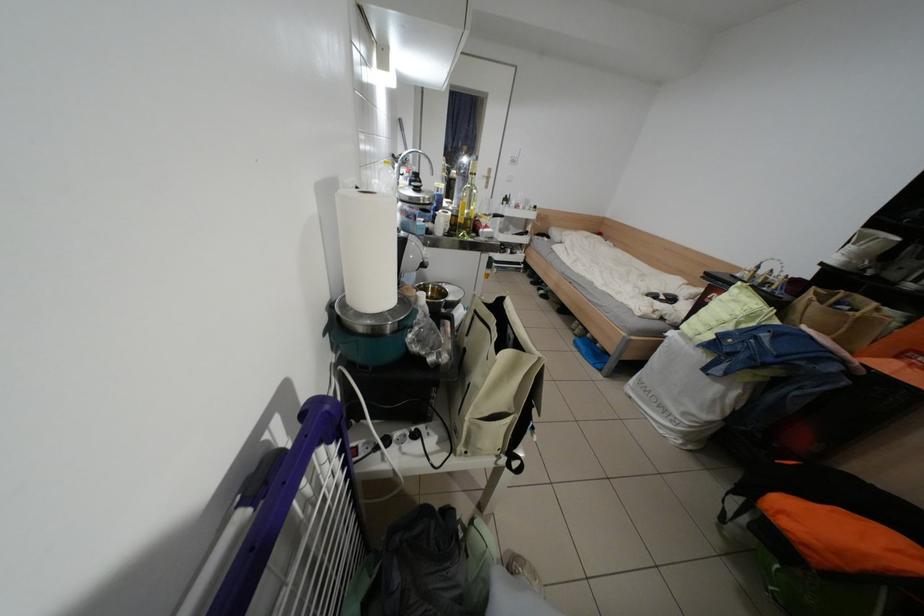
This screenshot has height=616, width=924. Identify the location of bag top handle. [x=837, y=315].